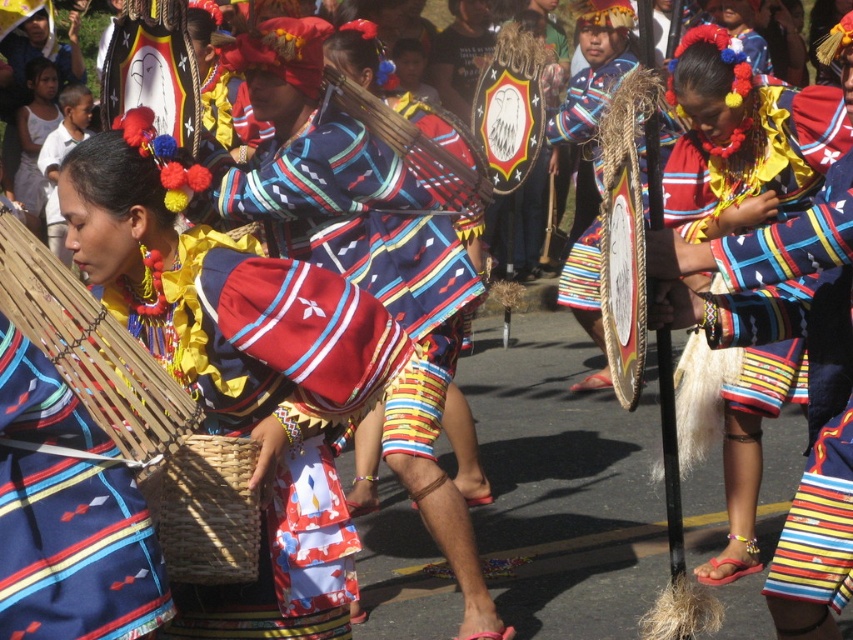
You are a photographer standing at the origin point of the scene. You want to capture a photo of the matte woven basket at center. What are the coordinates of the basket?

The coordinates of the matte woven basket at center are at point (238, 368).

You are a photographer trying to capture the festival scene. You notice two points in the image at coordinates point (35,611) and point (294,248). If you want to focus on the one that is closer to the camera, which coordinate should you aim your camera at?

Point (35,611) is in front of point (294,248), so you should aim your camera at point (35,611) to focus on the one closer to the camera.